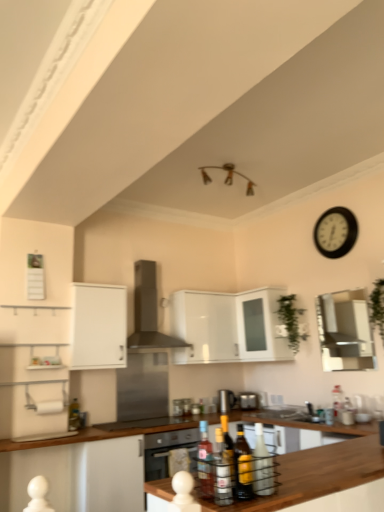
What are the coordinates of `unoccupied region to the right of translucent glass bottle at center, the 4th bottle in the left-to-right sequence` in the screenshot? It's located at (275, 490).